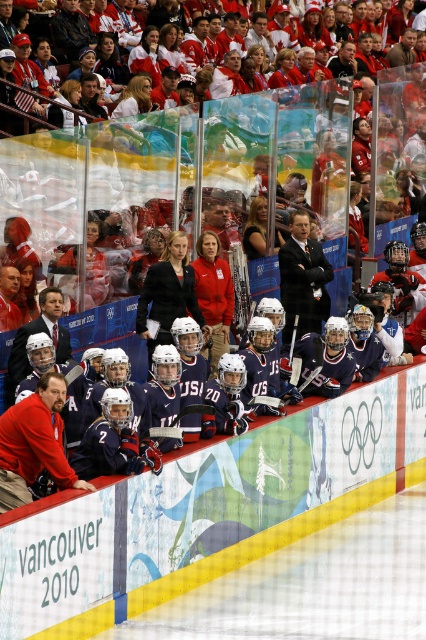
You are a photographer trying to capture a closeup shot of the dark blue suit at center and the matte black hockey at center. Since your camera can only focus on one object at a time, which object should you choose to ensure the entire object fits in the frame?

The dark blue suit at center has a lesser width compared to the matte black hockey at center, so you should choose the dark blue suit at center to ensure the entire object fits in the frame.

You are a player on the USA team bench during the Vancouver 2010 Winter Olympics hockey game. You need to grab your equipment quickly. Which item is closer to your left hand if both the matte black hockey stick at center and the matte black hockey at center are within your reach?

The matte black hockey stick at center is positioned on the left side of the matte black hockey at center, so it is closer to your left hand.